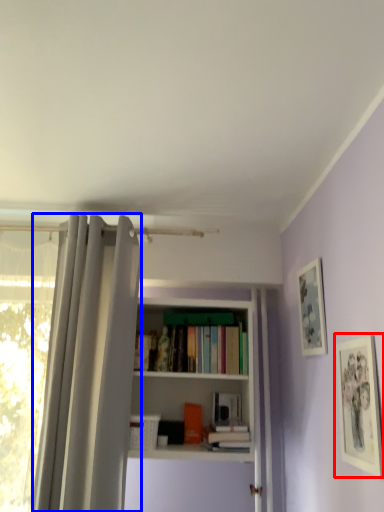
Question: Which point is further to the camera, picture frame (highlighted by a red box) or shower curtain (highlighted by a blue box)?

Choices:
 (A) picture frame
 (B) shower curtain

Answer: (B)